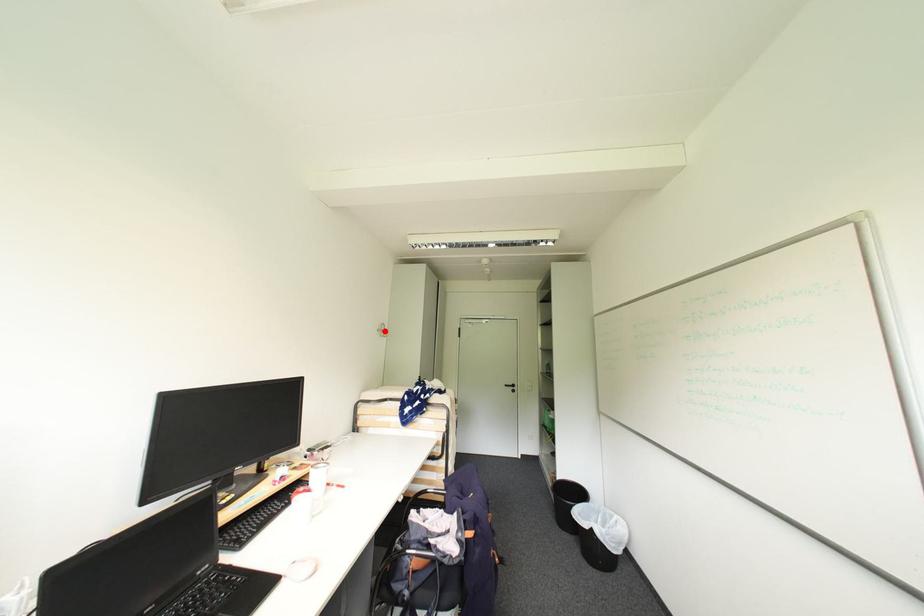
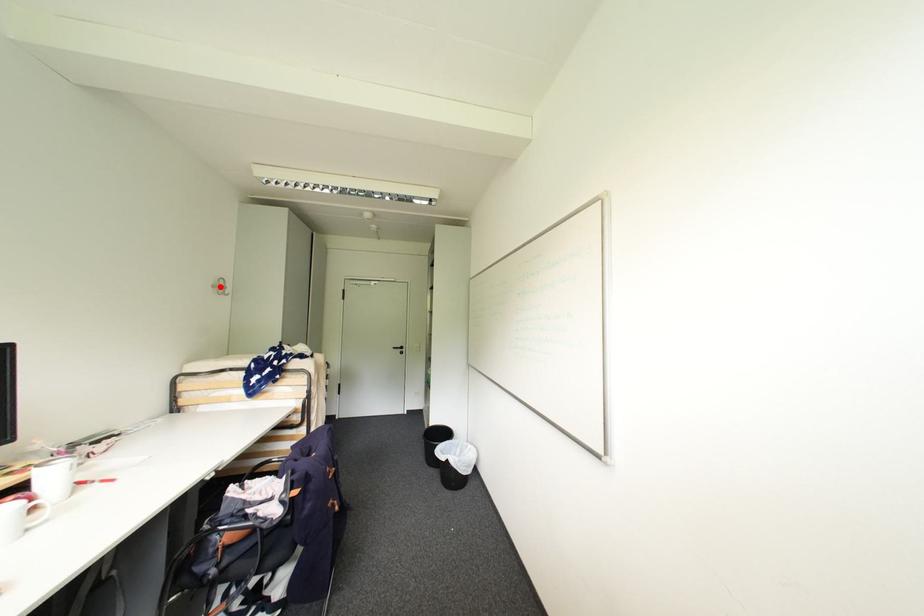
I am providing you with two images of the same scene from different viewpoints. A red point is marked on the first image and another point is marked on the second image. Is the marked point in image1 the same physical position as the marked point in image2?

Yes